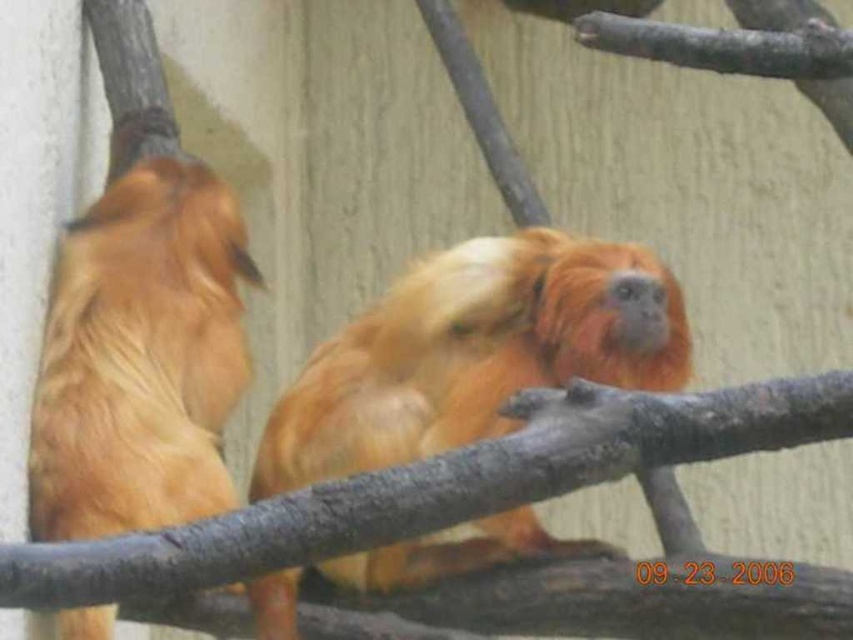
You are a zookeeper observing two golden fur monkeys in their enclosure. You see the golden fur monkey at center and the golden fur monkey at left. Which one is positioned more to the right side of the enclosure?

The golden fur monkey at center is positioned more to the right side of the enclosure than the golden fur monkey at left.

In the scene shown: You are a zookeeper observing two golden fur monkeys in their enclosure. You notice the golden fur monkey at center and the golden fur monkey at left. Which one appears bigger in size?

The golden fur monkey at center appears bigger in size than the golden fur monkey at left.